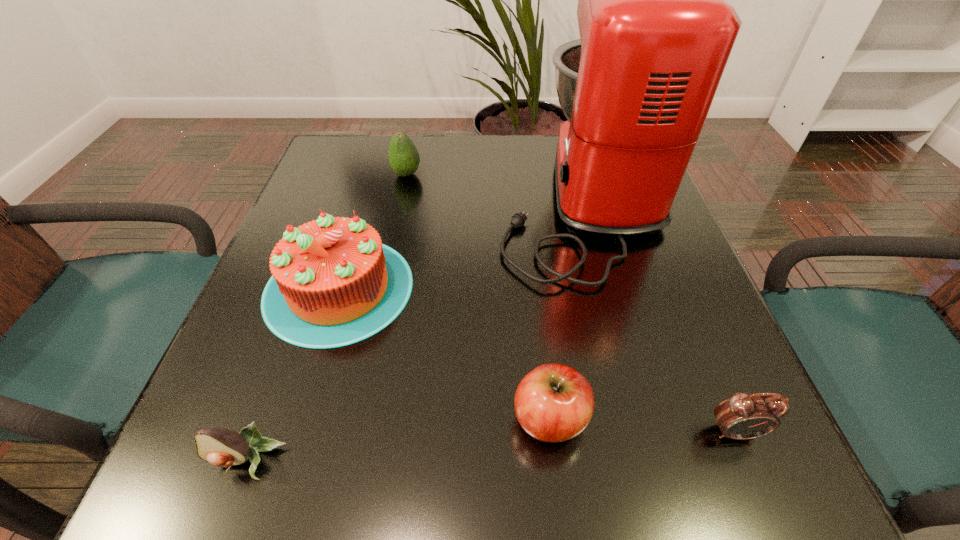
Image resolution: width=960 pixels, height=540 pixels. In order to click on vacant space in between the alarm clock and the nearer avocado in this screenshot , I will do `click(492, 446)`.

The image size is (960, 540). Identify the location of empty space between the second tallest object and the nearer avocado. (294, 374).

Image resolution: width=960 pixels, height=540 pixels. I want to click on free space between the kitchen mixer and the farther avocado, so click(492, 187).

At what (x,y) coordinates should I click in order to perform the action: click on free spot between the kitchen mixer and the cake. Please return your answer as a coordinate pair (x, y). This screenshot has width=960, height=540. Looking at the image, I should click on (459, 244).

Image resolution: width=960 pixels, height=540 pixels. I want to click on unoccupied position between the fifth shortest object and the apple, so click(x=444, y=353).

Image resolution: width=960 pixels, height=540 pixels. Find the location of `free space between the kitchen mixer and the left avocado`. free space between the kitchen mixer and the left avocado is located at coordinates (414, 330).

Identify the location of vacant area between the left avocado and the alarm clock. (492, 446).

This screenshot has height=540, width=960. I want to click on vacant point located between the apple and the right avocado, so click(478, 296).

This screenshot has height=540, width=960. What are the coordinates of `object that ranks as the fourth closest to the alarm clock` in the screenshot? It's located at (220, 447).

Locate an element on the screen. the closest object to the apple is located at coordinates (743, 416).